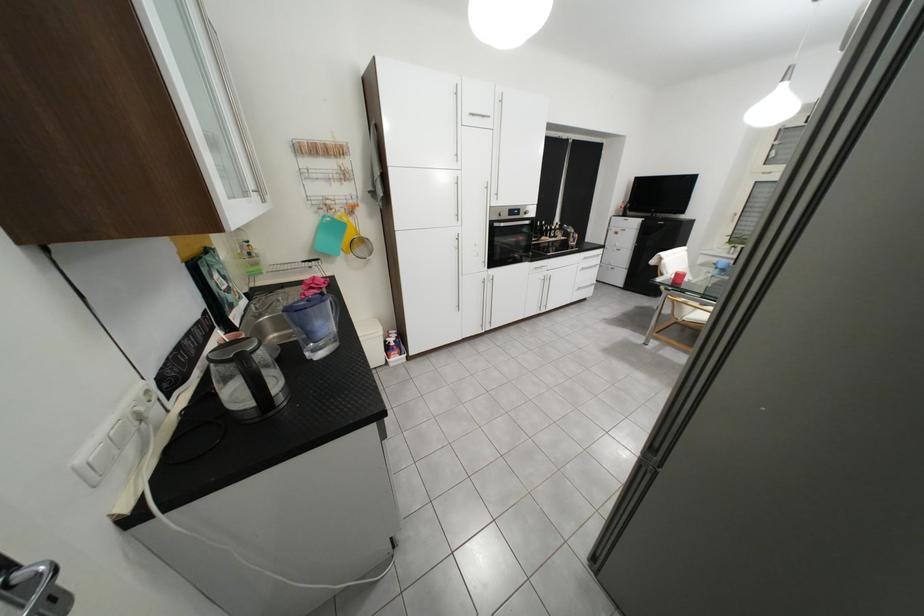
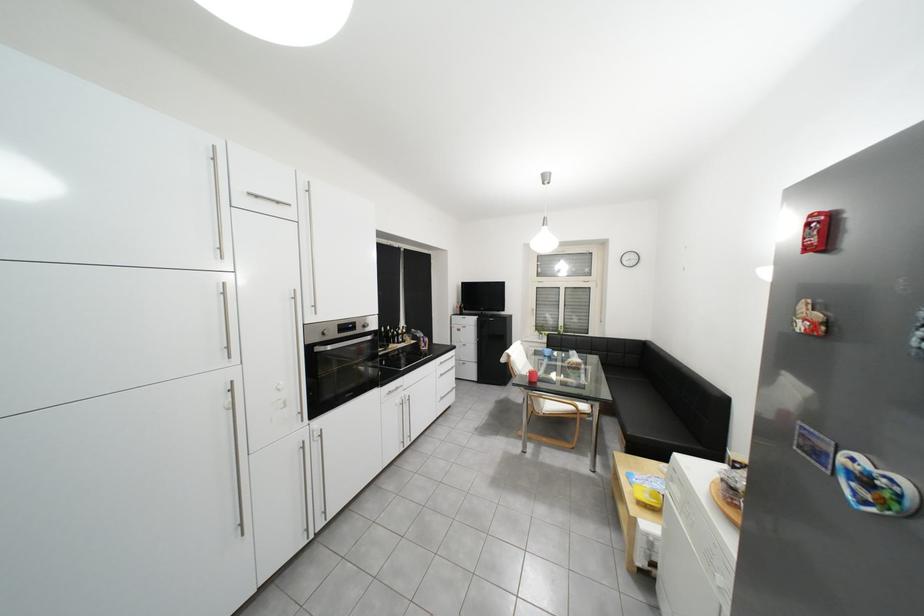
Find the pixel in the second image that matches [540,224] in the first image.

(381, 339)